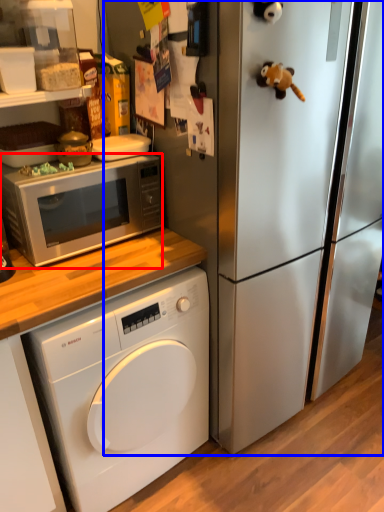
Question: Which of the following is the farthest to the observer, microwave oven (highlighted by a red box) or refrigerator (highlighted by a blue box)?

Choices:
 (A) microwave oven
 (B) refrigerator

Answer: (A)